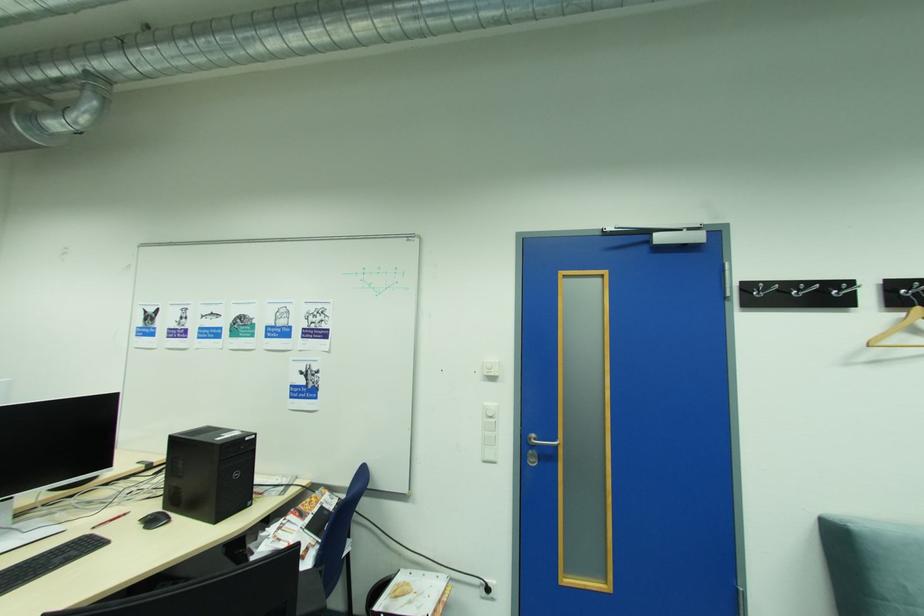
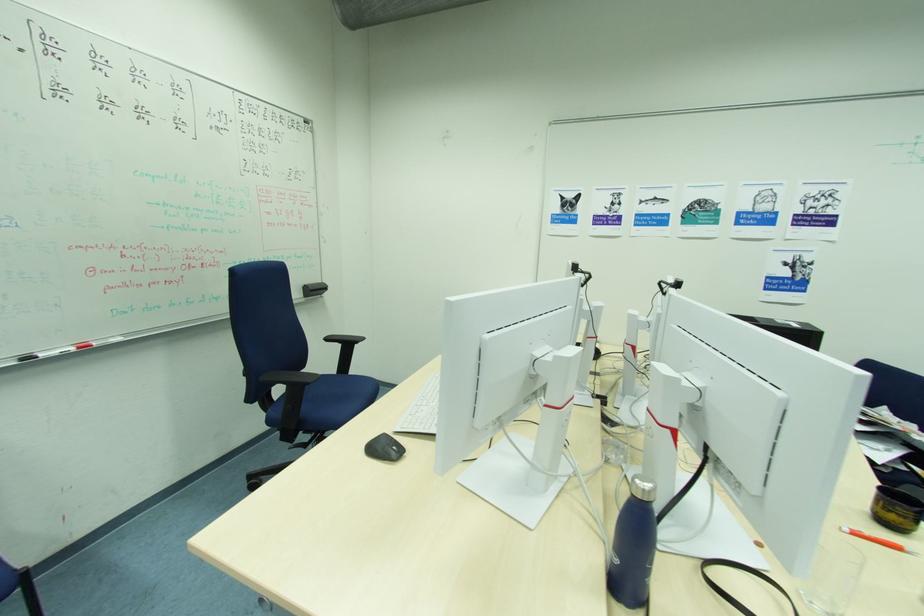
Question: What movement of the cameraman would produce the second image?

Choices:
 (A) Left
 (B) Right
 (C) Forward
 (D) Backward

Answer: (A)